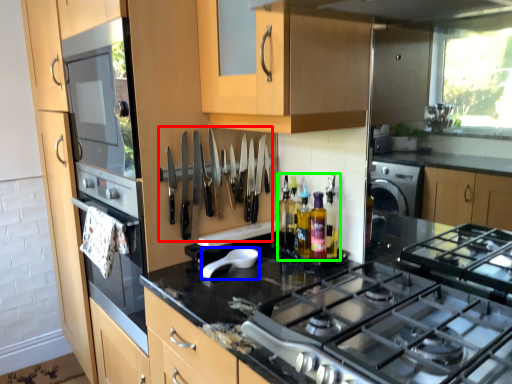
Question: Estimate the real-world distances between objects in this image. Which object is farther from cutlery (highlighted by a red box), appliance (highlighted by a blue box) or bottle (highlighted by a green box)?

Choices:
 (A) appliance
 (B) bottle

Answer: (B)